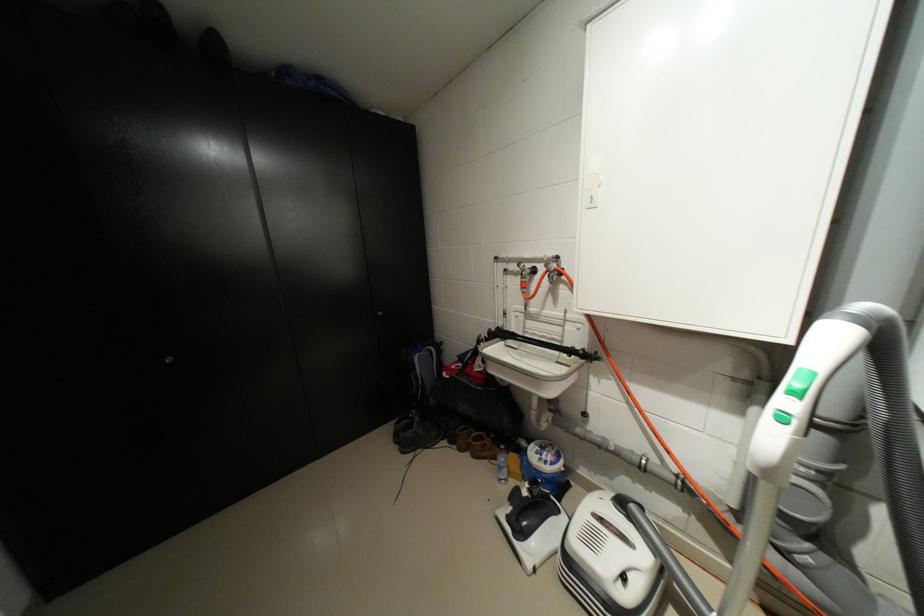
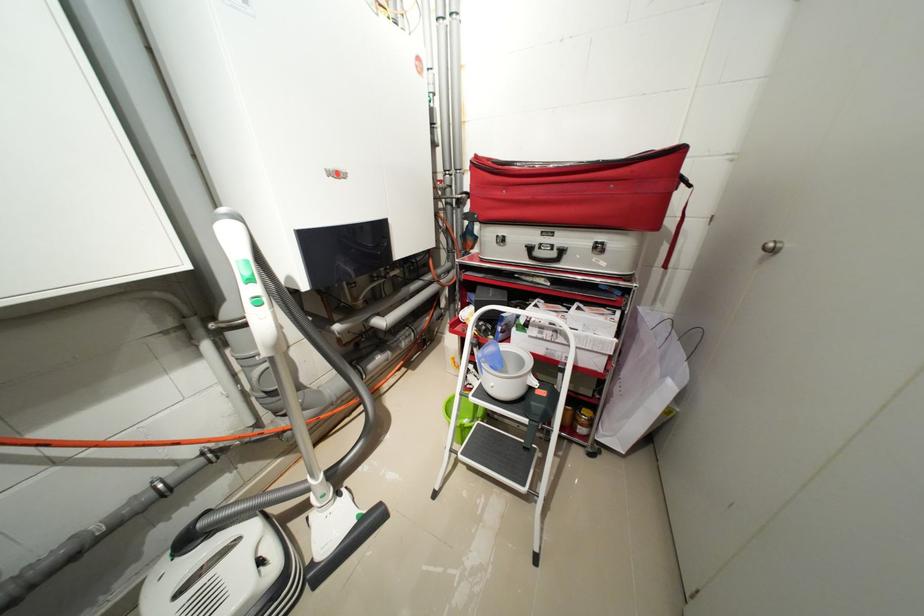
How did the camera likely rotate?

The camera rotated toward right-down.